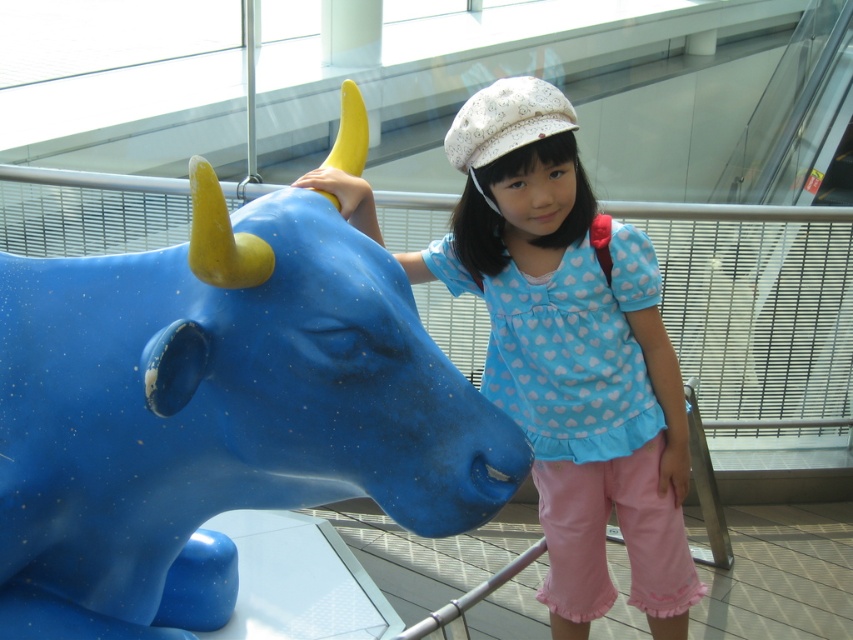
You are an architect designing a new gallery layout. The blue glossy bull at left is placed at coordinates 0.645, 0.256. If you want to ensure visitors can comfortably view the bull from all angles, what is the minimum recommended distance in meters between the bull and the nearest wall?

The minimum recommended distance between the bull and the nearest wall should be at least half the bull sculpture height to allow comfortable viewing from all angles. Since the bull is positioned at coordinates (218, 412), this ensures visitors can move around it without obstruction.

You are an art curator planning to display both the blue glossy bull at left and the matte blue statue at center in a new exhibition. Based on their sizes, which one should be placed closer to the entrance to ensure visitors notice the larger artwork first?

The matte blue statue at center should be placed closer to the entrance because it is taller than the blue glossy bull at left, making it more noticeable to visitors upon entering.